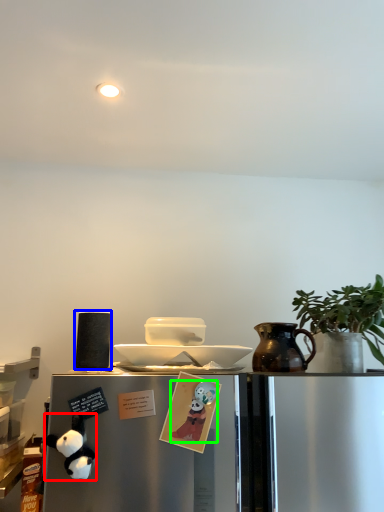
Question: Based on their relative distances, which object is farther from toy (highlighted by a red box)? Choose from appliance (highlighted by a blue box) and toy (highlighted by a green box).

Choices:
 (A) appliance
 (B) toy

Answer: (B)